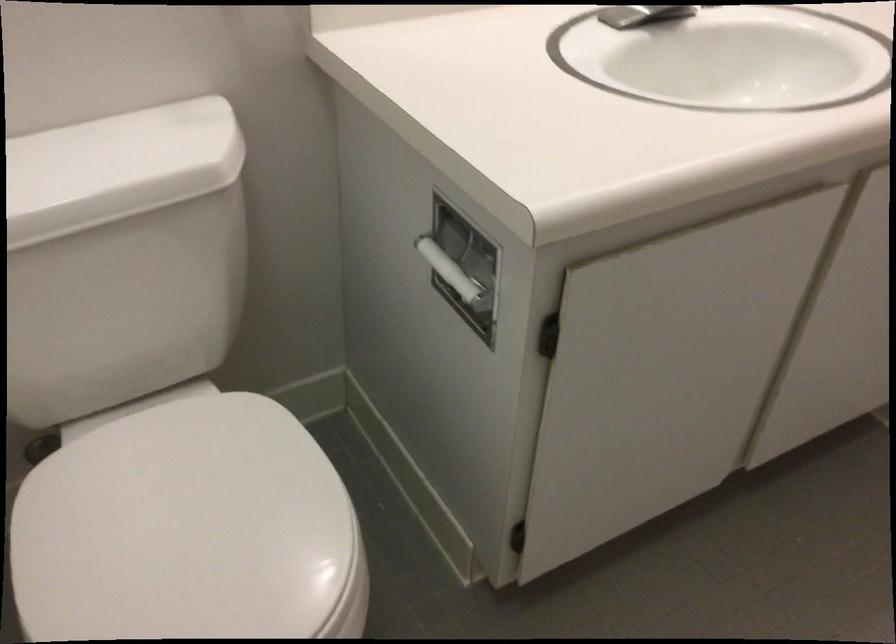
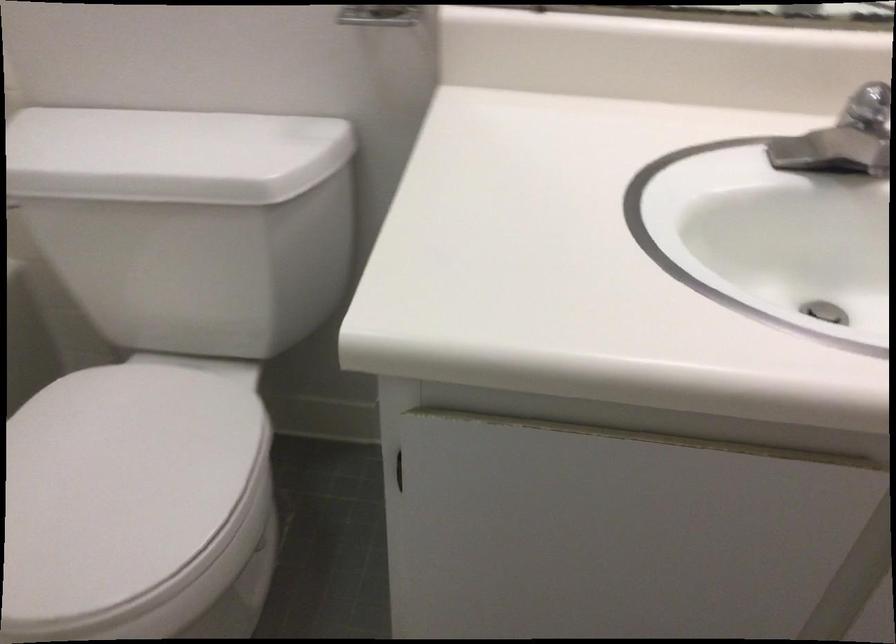
Question: The first image is from the beginning of the video and the second image is from the end. How did the camera likely rotate when shooting the video?

Choices:
 (A) Left
 (B) Right
 (C) Up
 (D) Down

Answer: (A)